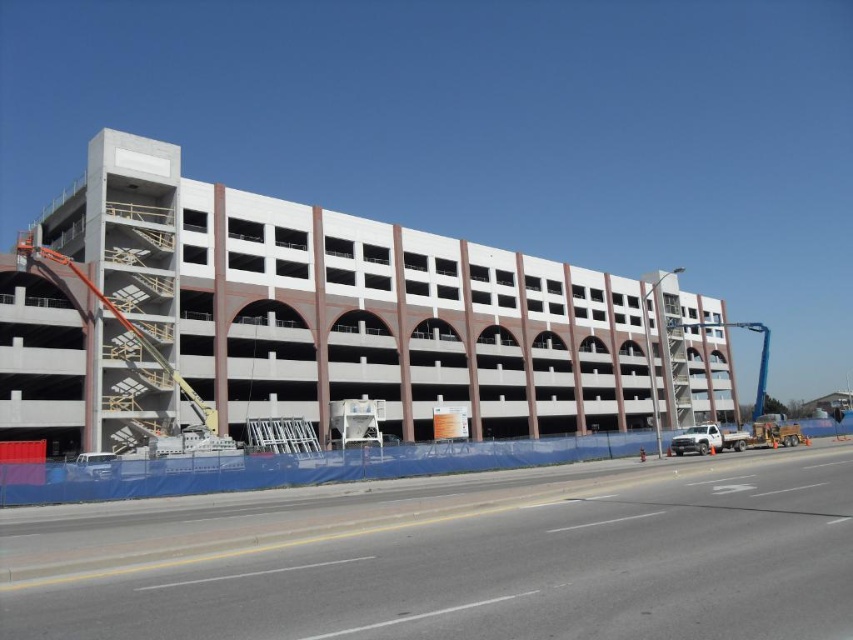
Question: Can you confirm if white concrete parking garage at center is smaller than blue tarp at lower left?

Choices:
 (A) yes
 (B) no

Answer: (B)

Question: Among these objects, which one is nearest to the camera?

Choices:
 (A) white concrete parking garage at center
 (B) orange metallic crane at left

Answer: (A)

Question: Is white concrete parking garage at center to the left of blue metallic crane at right from the viewer's perspective?

Choices:
 (A) no
 (B) yes

Answer: (B)

Question: Observing the image, what is the correct spatial positioning of white concrete parking garage at center in reference to blue tarp at lower left?

Choices:
 (A) below
 (B) above

Answer: (B)

Question: Based on their relative distances, which object is nearer to the white concrete parking garage at center?

Choices:
 (A) blue metallic crane at right
 (B) blue tarp at lower left

Answer: (A)

Question: Among these objects, which one is nearest to the camera?

Choices:
 (A) blue metallic crane at right
 (B) blue tarp at lower left
 (C) white concrete parking garage at center
 (D) orange metallic crane at left

Answer: (B)